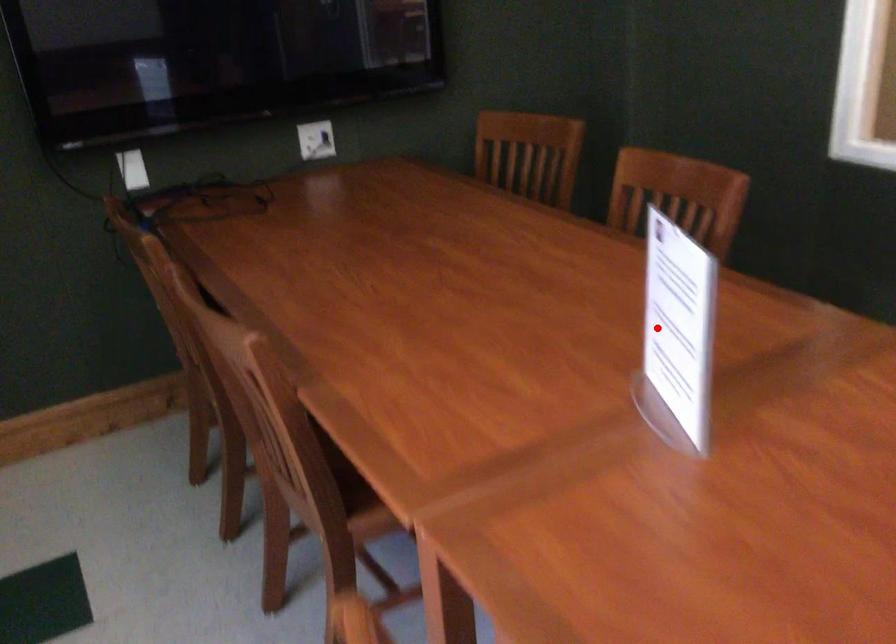
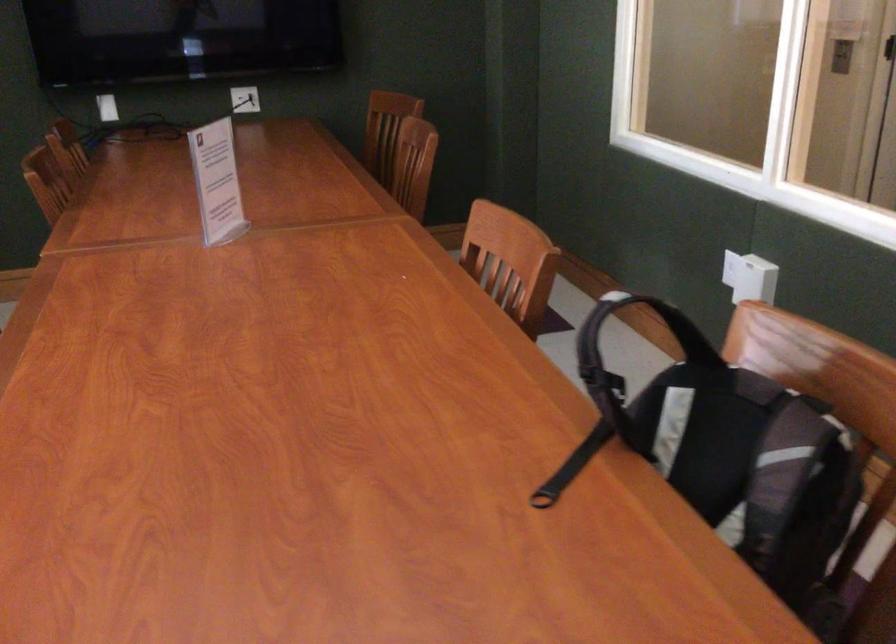
Find the pixel in the second image that matches the highlighted location in the first image.

(217, 182)